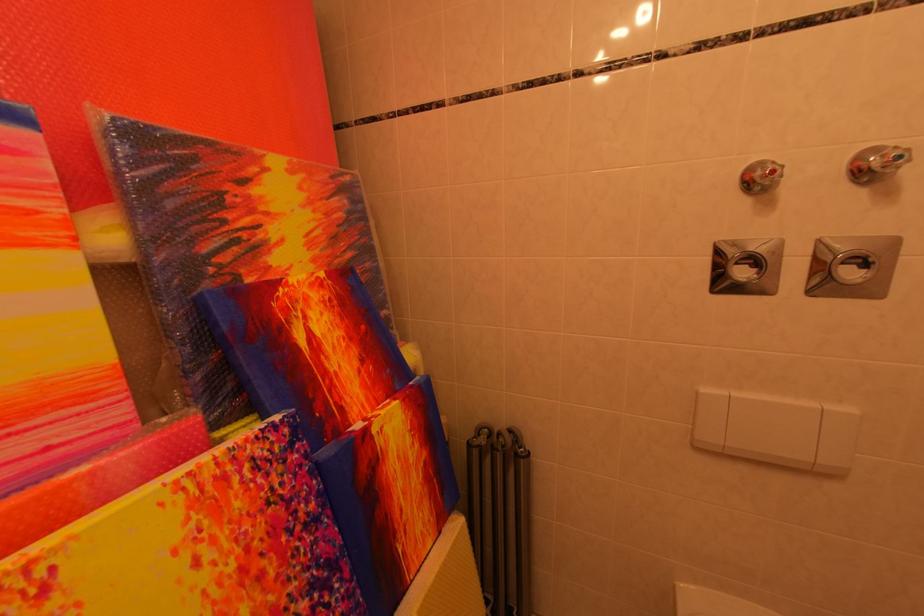
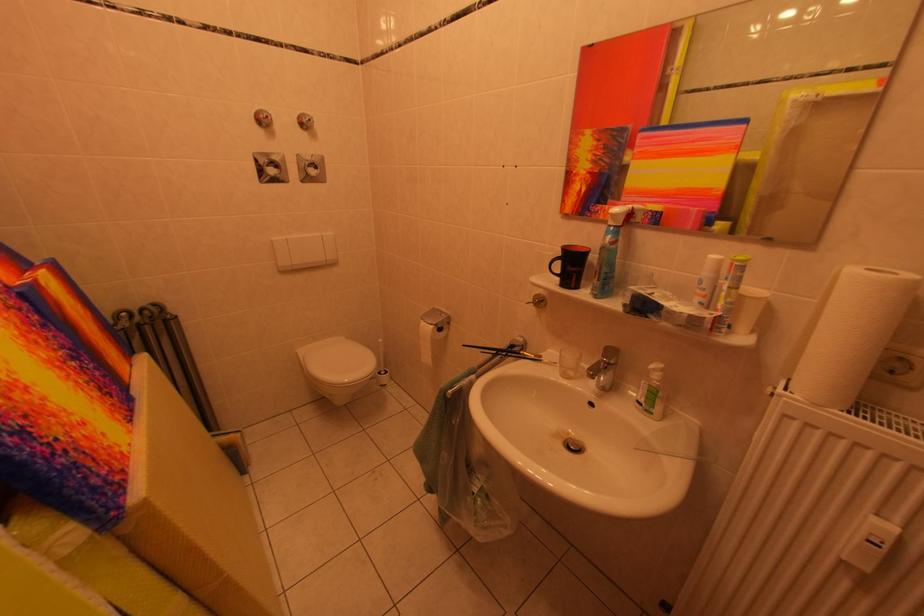
In the second image, find the point that corresponds to (x=768, y=177) in the first image.

(271, 120)